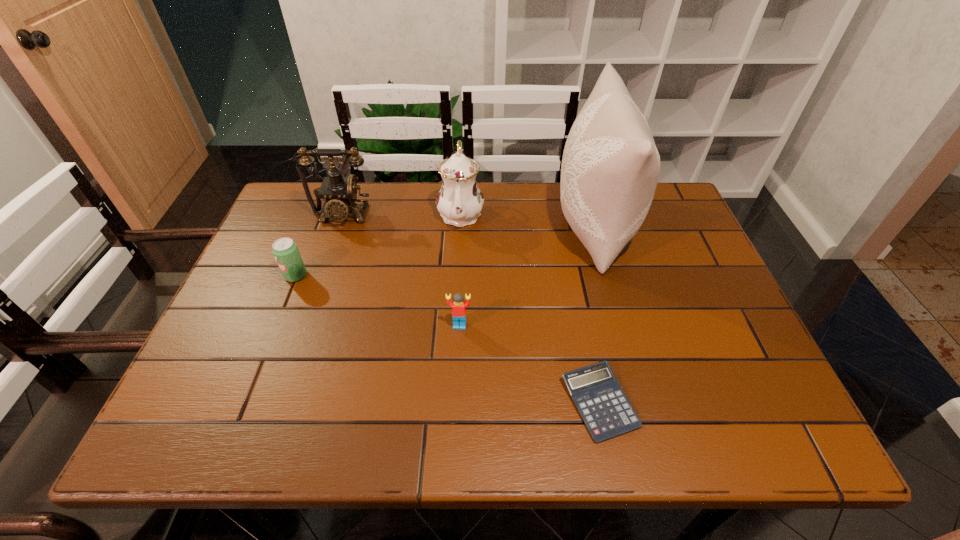
The image size is (960, 540). I want to click on vacant region between the soda and the nearest object, so click(447, 339).

This screenshot has width=960, height=540. In order to click on vacant space that is in between the tallest object and the nearest object in this screenshot , I will do [596, 314].

Identify the location of blank region between the second nearest object and the cushion. Image resolution: width=960 pixels, height=540 pixels. (527, 275).

You are a GUI agent. You are given a task and a screenshot of the screen. Output one action in this format:
    pyautogui.click(x=<x>, y=<y>)
    Task: Click on the vacant area that lies between the telephone and the soda
    This screenshot has width=960, height=540.
    Given the screenshot: What is the action you would take?
    pyautogui.click(x=319, y=246)

Locate an element on the screen. vacant area that lies between the chinaware and the second nearest object is located at coordinates click(460, 269).

At what (x,y) coordinates should I click in order to perform the action: click on vacant point located between the shortest object and the telephone. Please return your answer as a coordinate pair (x, y). Image resolution: width=960 pixels, height=540 pixels. Looking at the image, I should click on (471, 309).

This screenshot has height=540, width=960. What are the coordinates of `empty location between the second nearest object and the soda` in the screenshot? It's located at (377, 300).

You are a GUI agent. You are given a task and a screenshot of the screen. Output one action in this format:
    pyautogui.click(x=<x>, y=<y>)
    Task: Click on the free space between the Lego and the telephone
    This screenshot has width=960, height=540.
    Given the screenshot: What is the action you would take?
    pyautogui.click(x=401, y=271)

At what (x,y) coordinates should I click in order to perform the action: click on vacant region between the shortest object and the soda. Please return your answer as a coordinate pair (x, y). This screenshot has width=960, height=540. Looking at the image, I should click on (447, 339).

The image size is (960, 540). Find the location of `free spot between the Lego and the soda`. free spot between the Lego and the soda is located at coordinates (377, 300).